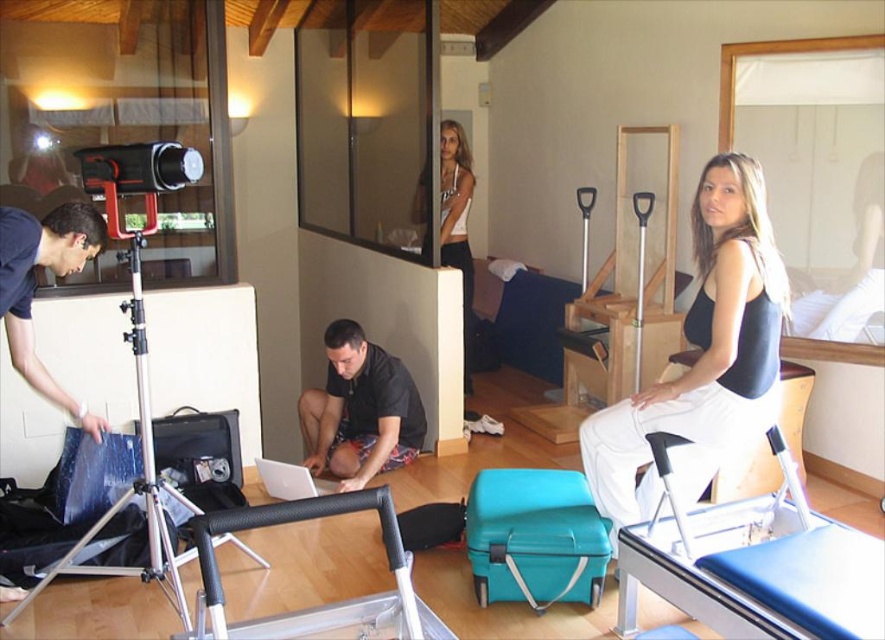
Measure the distance from black matte laptop at center to black rubber handle at center.

A distance of 6.54 feet exists between black matte laptop at center and black rubber handle at center.

Is black matte laptop at center to the right of black rubber handle at center from the viewer's perspective?

In fact, black matte laptop at center is to the left of black rubber handle at center.

Which is behind, point (325, 392) or point (401, 608)?

Point (325, 392)

Where is `black matte laptop at center`? black matte laptop at center is located at coordinates (360, 410).

Who is more forward, (730, 579) or (148, 525)?

Point (730, 579) is more forward.

At what (x,y) coordinates should I click in order to perform the action: click on blue rubber mat at lower right. Please return your answer as a coordinate pair (x, y). The width and height of the screenshot is (885, 640). Looking at the image, I should click on (757, 566).

Find the location of a particular element. blue rubber mat at lower right is located at coordinates (757, 566).

Measure the distance from teal fabric suitcase at center to white tank top at upper center.

teal fabric suitcase at center is 1.85 meters from white tank top at upper center.

Is teal fabric suitcase at center smaller than white tank top at upper center?

Correct, teal fabric suitcase at center occupies less space than white tank top at upper center.

This screenshot has height=640, width=885. In order to click on teal fabric suitcase at center in this screenshot , I will do `click(535, 538)`.